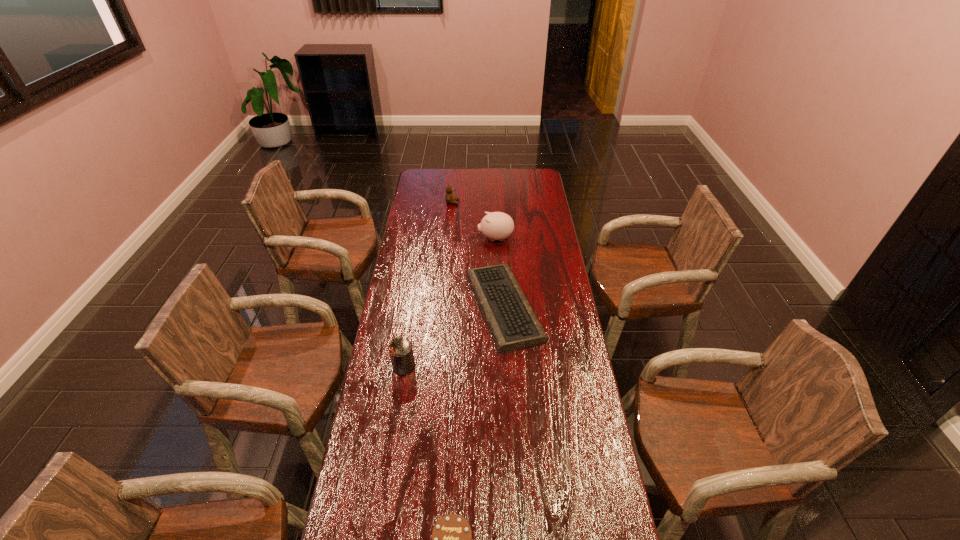
Find the location of a particular element. vacant point located between the second farthest object and the can is located at coordinates (449, 302).

Locate an element on the screen. free space between the computer keyboard and the teddy bear is located at coordinates (478, 254).

Identify the location of free spot between the second farthest object and the leftmost object. (449, 302).

Find the location of a particular element. empty space between the farthest object and the fourth nearest object is located at coordinates (474, 220).

Find the location of a particular element. The image size is (960, 540). object that is the closest to the shortest object is located at coordinates (497, 225).

Find the location of `the fourth closest object to the teddy bear`. the fourth closest object to the teddy bear is located at coordinates (451, 538).

Where is `blank space that satisfies the following two spatial constraints: 1. on the back side of the third nearest object; 2. at the snout of the fourth nearest object`? blank space that satisfies the following two spatial constraints: 1. on the back side of the third nearest object; 2. at the snout of the fourth nearest object is located at coordinates (500, 239).

Image resolution: width=960 pixels, height=540 pixels. I want to click on free spot that satisfies the following two spatial constraints: 1. at the snout of the second farthest object; 2. on the right side of the computer keyboard, so pos(498,307).

The height and width of the screenshot is (540, 960). In order to click on free space in the image that satisfies the following two spatial constraints: 1. at the snout of the piggy bank; 2. on the front side of the can in this screenshot , I will do `click(501, 366)`.

Locate an element on the screen. vacant point that satisfies the following two spatial constraints: 1. on the back side of the third nearest object; 2. at the snout of the fourth nearest object is located at coordinates (500, 239).